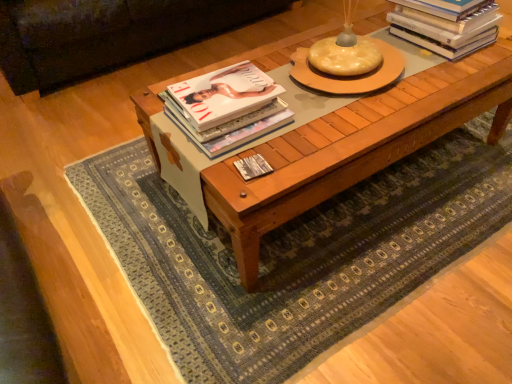
This screenshot has height=384, width=512. I want to click on vacant area that lies to the right of white glossy book at center, the 1th book positioned from the bottom, so click(300, 159).